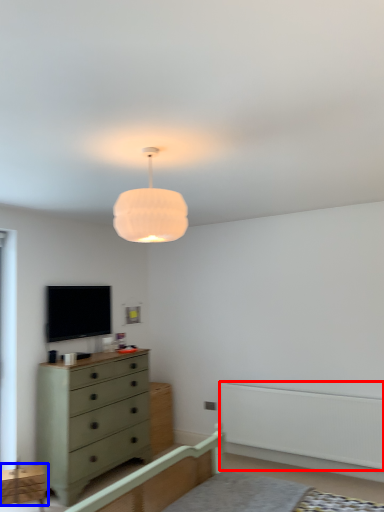
Question: Which of the following is the closest to the observer, balustrade (highlighted by a red box) or cabinetry (highlighted by a blue box)?

Choices:
 (A) balustrade
 (B) cabinetry

Answer: (B)